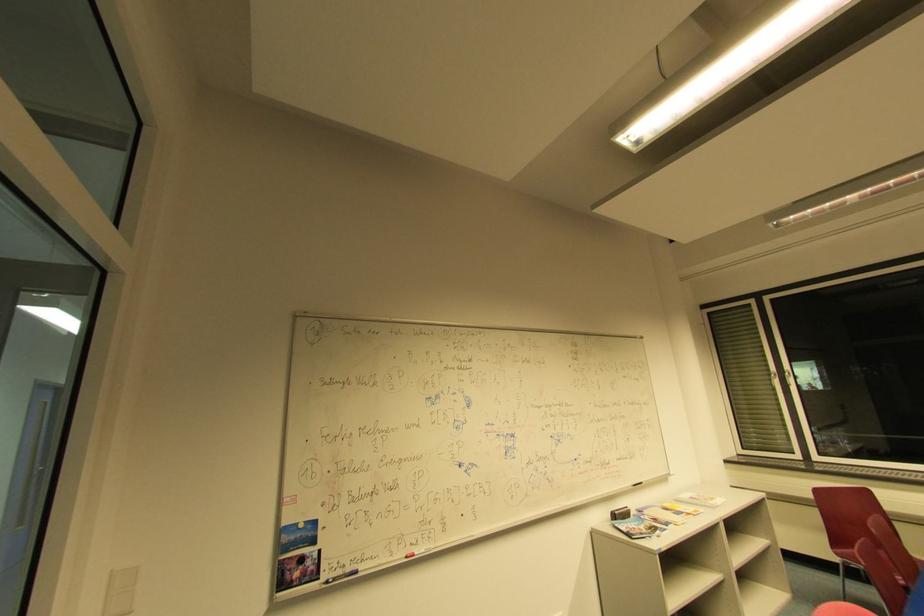
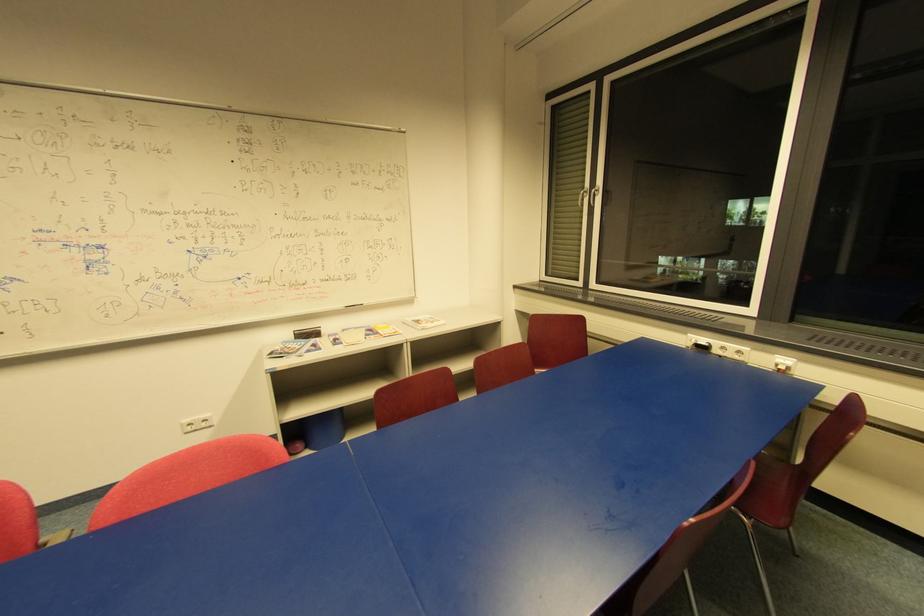
Where in the second image is the point corresponding to (x=791, y=375) from the first image?

(598, 192)